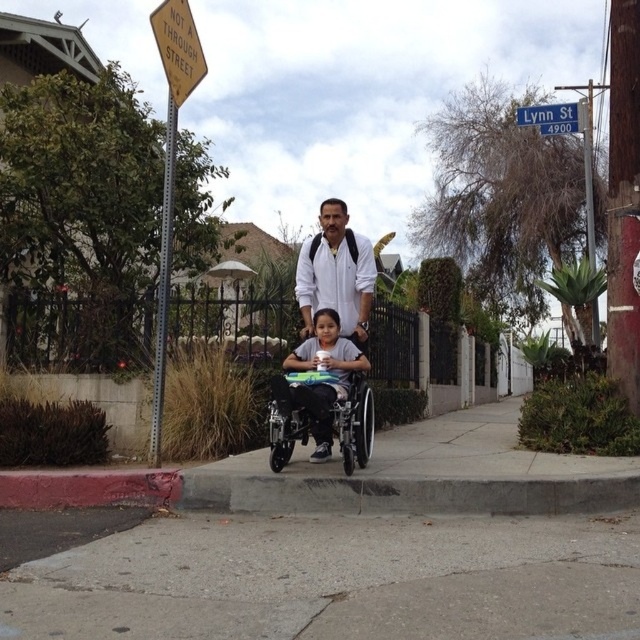
Between matte plastic wheelchair at center and blue plastic street sign at upper center, which one is positioned lower?

matte plastic wheelchair at center is below.

Who is more distant from viewer, (328, 400) or (529, 106)?

Point (529, 106)

You are a GUI agent. You are given a task and a screenshot of the screen. Output one action in this format:
    pyautogui.click(x=<x>, y=<y>)
    Task: Click on the matte plastic wheelchair at center
    This screenshot has width=640, height=640.
    Given the screenshot: What is the action you would take?
    pyautogui.click(x=323, y=380)

Is point (534, 604) more distant than point (342, 387)?

No, it is not.

Between point (161, 614) and point (314, 368), which one is positioned behind?

Positioned behind is point (314, 368).

What are the coordinates of `gray concrete sidewalk at lower center` in the screenshot? It's located at (337, 579).

Does point (371, 616) come in front of point (346, 244)?

Yes.

Is gray concrete sidewalk at lower center thinner than white matte shirt at center?

Answer: In fact, gray concrete sidewalk at lower center might be wider than white matte shirt at center.

Does point (4, 612) come in front of point (358, 266)?

Yes, point (4, 612) is in front of point (358, 266).

Find the location of a particular element. gray concrete sidewalk at lower center is located at coordinates (337, 579).